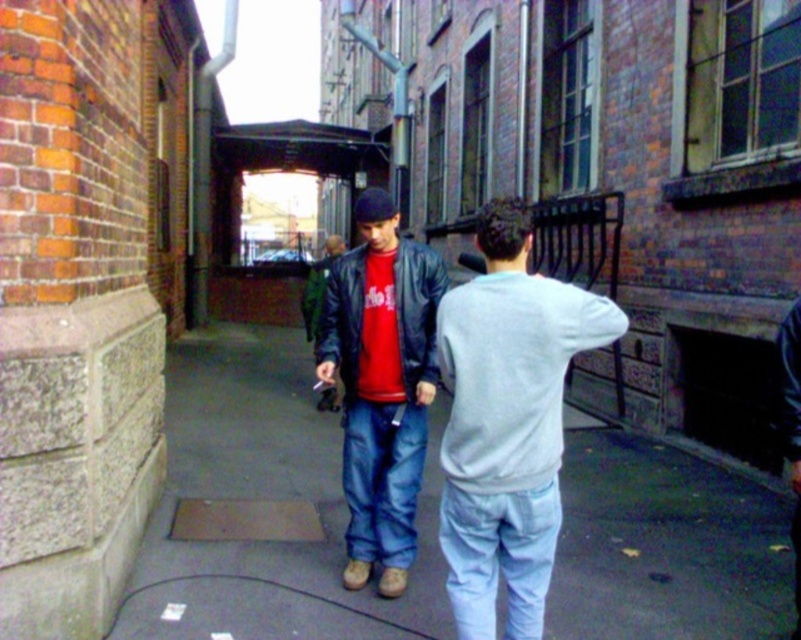
You are standing in the alleyway and want to place a small potted plant exactly at the point marked as point (266, 500). What type of surface will the plant be placed on?

The surface at point (266, 500) is smooth concrete pavement at center, so the small potted plant will be placed on the smooth concrete pavement at center.

Based on the photo, you are a photographer trying to capture a candid shot of the two people in the alley. You want to ensure both the light gray sweatshirt at center and the matte black leather jacket at center are visible in the frame. Based on their positions, which one is on the right side of the other?

The light gray sweatshirt at center is positioned on the right side of matte black leather jacket at center.